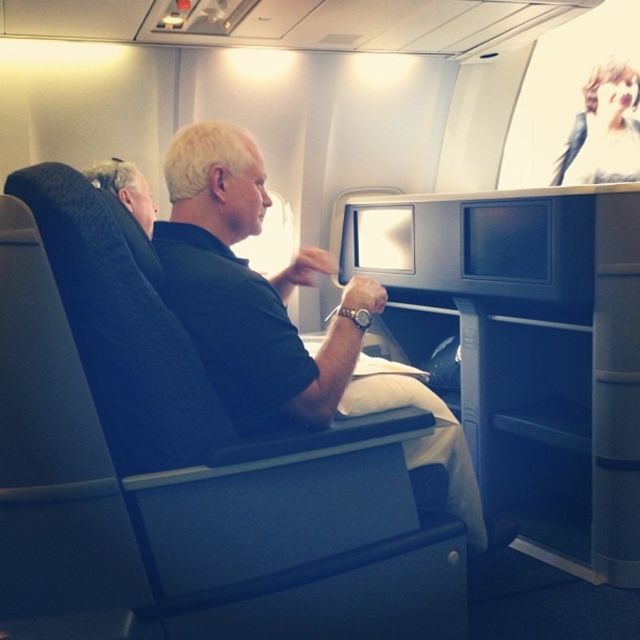
You are a flight attendant observing the passenger in the airplane cabin. You need to determine if the black fabric shirt at center can completely cover the blonde hair at upper left based on their sizes. Can it?

The black fabric shirt at center is bigger than the blonde hair at upper left, so yes, the black fabric shirt at center can completely cover the blonde hair at upper left.

In the airplane cabin scene, there is a black fabric shirt at center and a blonde hair at upper left. Which object is positioned to the left of the other?

The black fabric shirt at center is positioned to the left of the blonde hair at upper left.